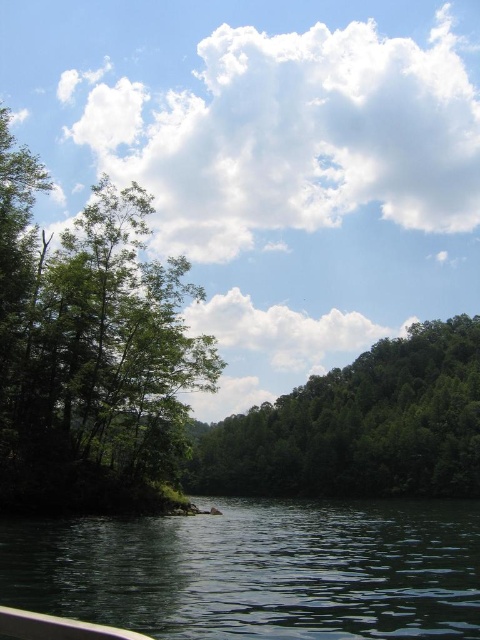
You are standing on a boat and looking at the dark green water at lower left and the green leafy tree at center. Which object is located to the right side of the other?

The dark green water at lower left is positioned on the left side of green leafy tree at center, so the green leafy tree at center is to the right of the dark green water at lower left.

You are standing on a boat and looking at the dark green water at lower left and the green leafy tree at left. Which object is positioned more to the right side of your view?

The dark green water at lower left is positioned more to the right side of your view compared to the green leafy tree at left.